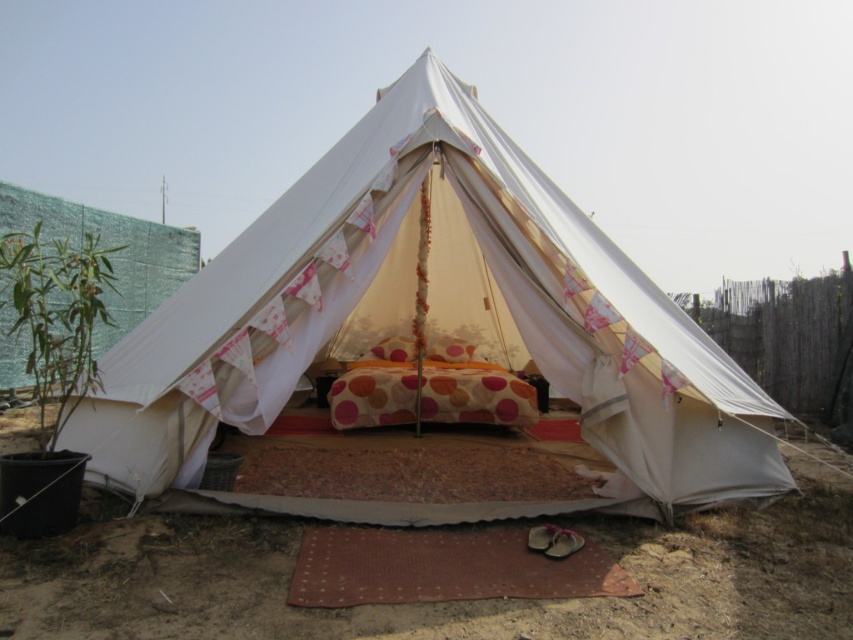
Is white canvas tent at center shorter than brown sandy dirt at lower center?

No.

Identify the location of white canvas tent at center. Image resolution: width=853 pixels, height=640 pixels. (432, 323).